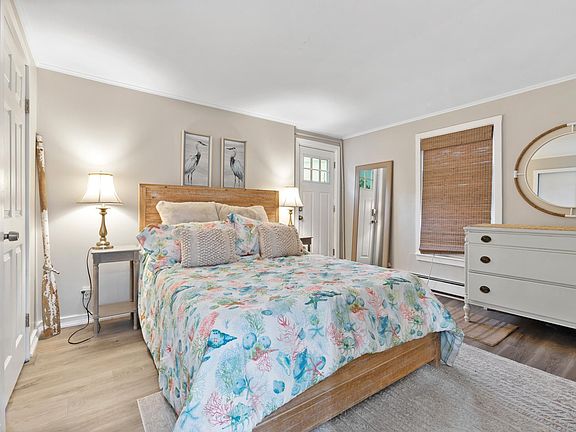
In order to click on drawers in this screenshot , I will do `click(540, 306)`, `click(534, 275)`, `click(533, 242)`, `click(113, 255)`.